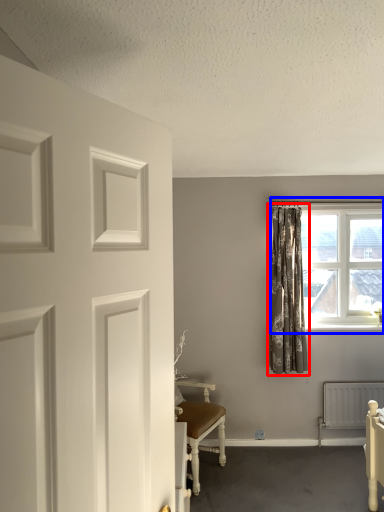
Question: Among these objects, which one is nearest to the camera, curtain (highlighted by a red box) or window (highlighted by a blue box)?

Choices:
 (A) curtain
 (B) window

Answer: (A)